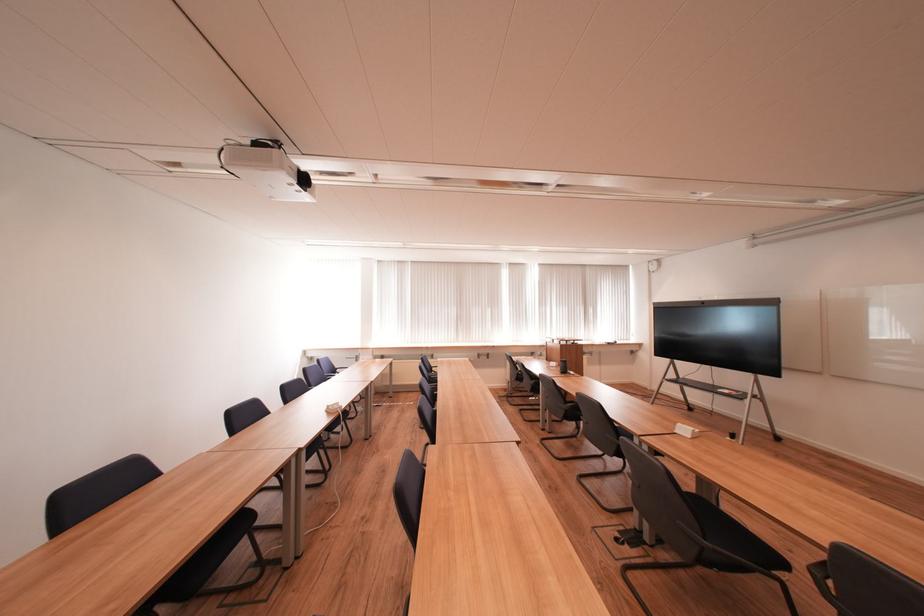
This screenshot has width=924, height=616. Describe the element at coordinates (686, 430) in the screenshot. I see `the white nameplate holder` at that location.